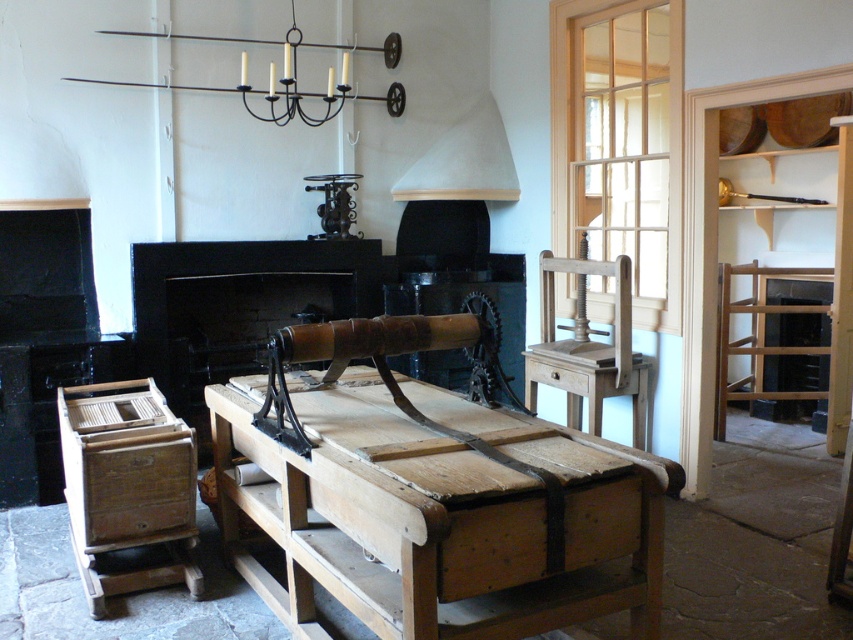
You are standing in the room and want to reach the point marked at coordinates (x=578, y=339). The wooden press is in your way. Can you walk around it to get to the point?

The distance of point (x=578, y=339) from viewer is 4.61 meters. Since the wooden press is between you and the point, you would need to navigate around it. However, without knowing the exact dimensions of the press or the available space around it, it is uncertain whether there is enough room to walk around. The answer cannot be definitively determined with the provided information.

You are an interior designer planning to add a new decorative item between the black matte fireplace at center and the black metal chandelier at upper center. Based on their positions, where should you place the new item to maintain symmetry?

A: The black metal chandelier at upper center is behind the black matte fireplace at center, so placing the new item in front of the fireplace would create symmetry by aligning it with the chandelier.